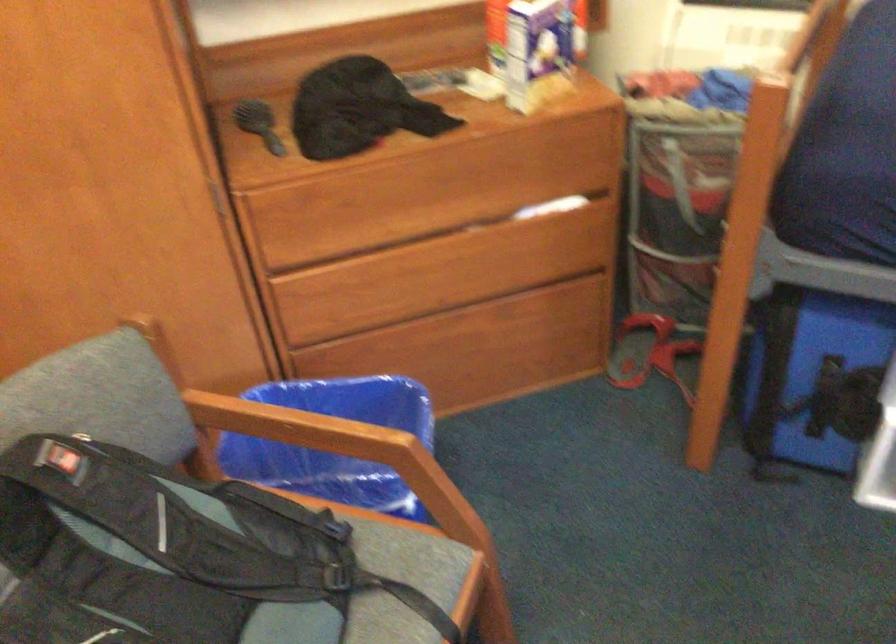
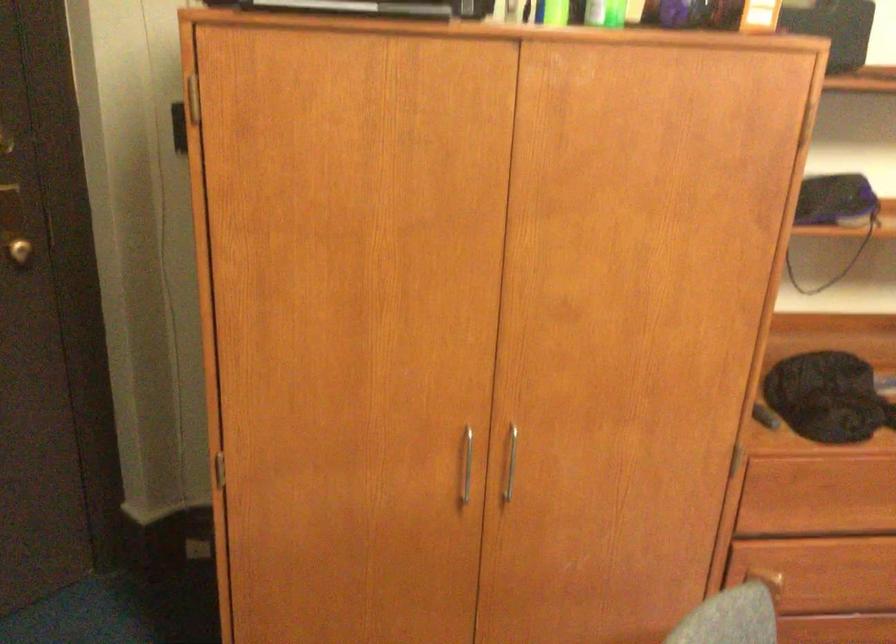
Question: How did the camera likely rotate?

Choices:
 (A) Left
 (B) Right
 (C) Up
 (D) Down

Answer: (C)